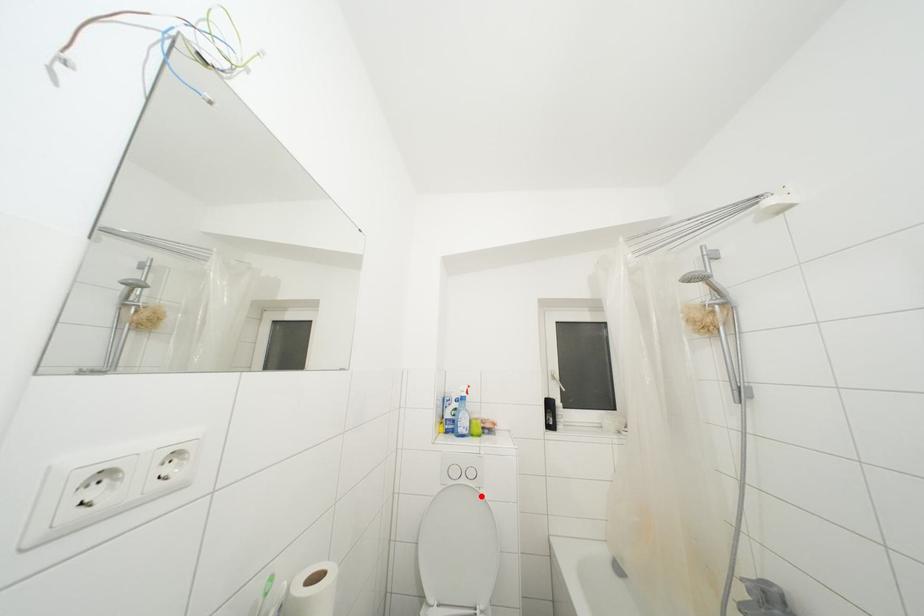
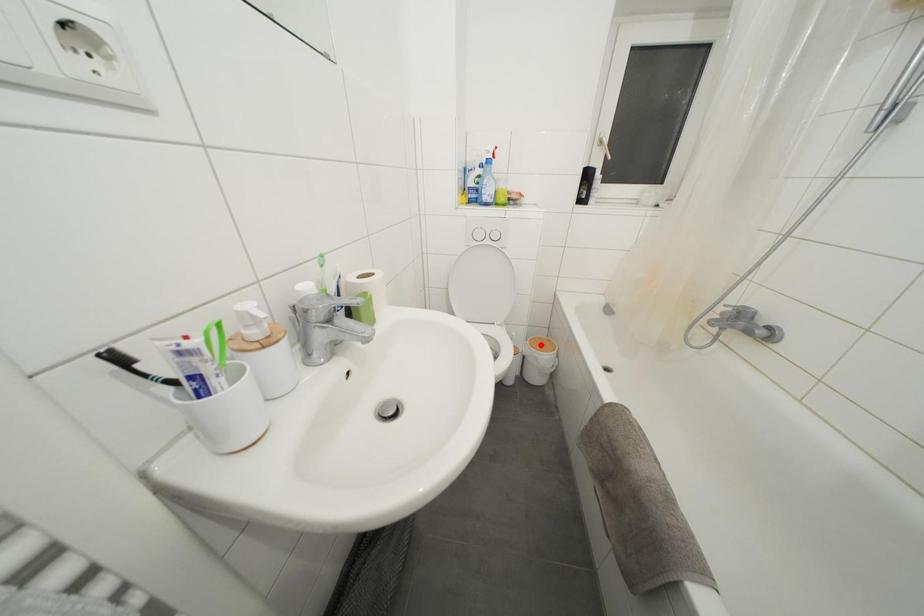
I am providing you with two images of the same scene from different viewpoints. A red point is marked on the first image and another point is marked on the second image. Is the marked point in image1 the same physical position as the marked point in image2?

No